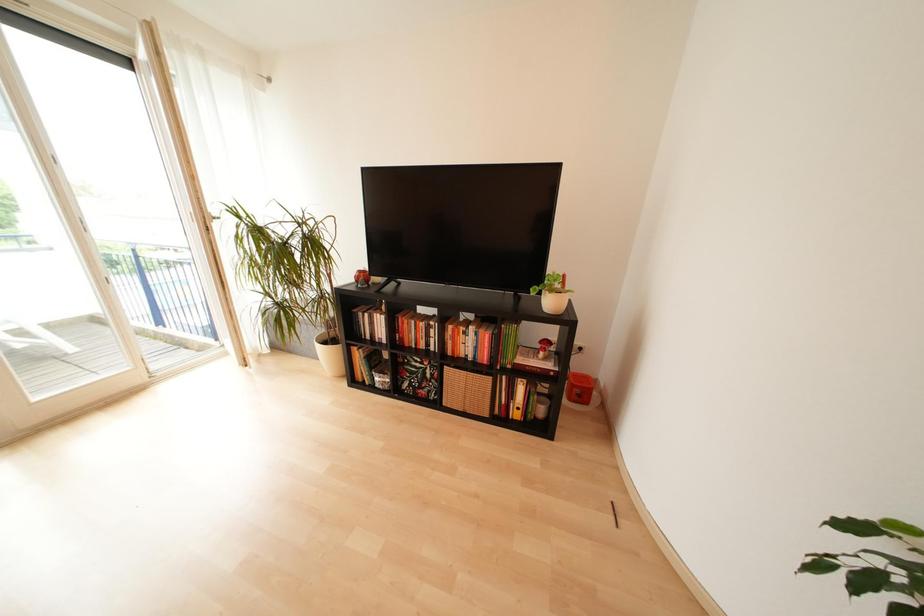
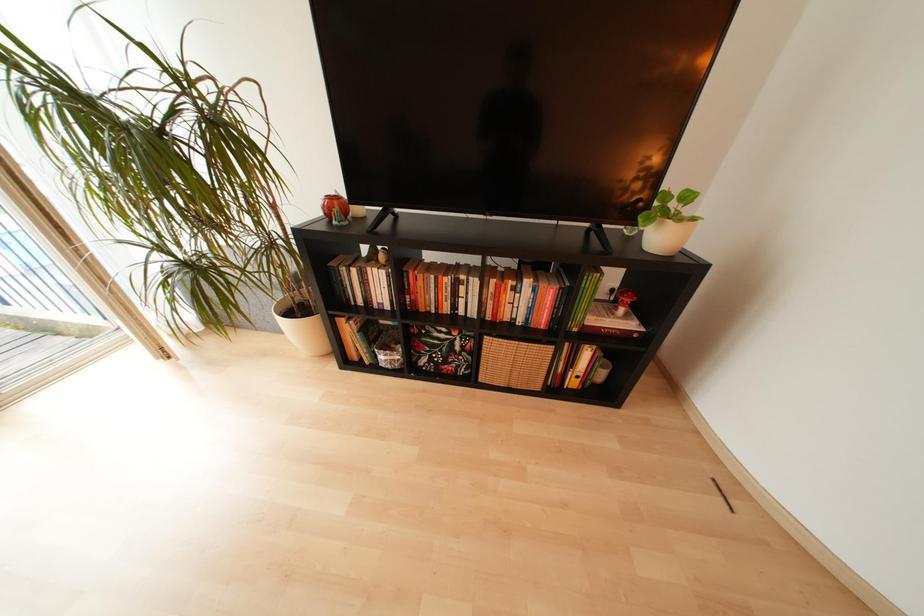
Question: The first image is from the beginning of the video and the second image is from the end. How did the camera likely rotate when shooting the video?

Choices:
 (A) Left
 (B) Right
 (C) Up
 (D) Down

Answer: (D)